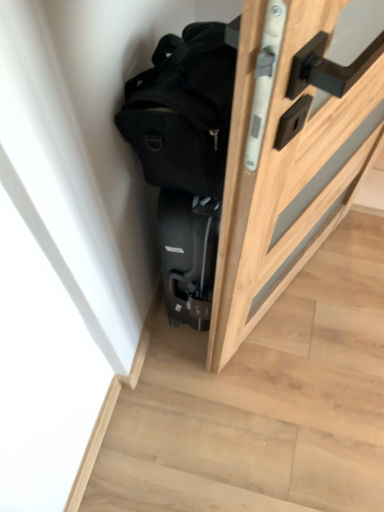
At what (x,y) coordinates should I click in order to perform the action: click on vacant space to the right of wooden door at right. Please return your answer as a coordinate pair (x, y). This screenshot has width=384, height=512. Looking at the image, I should click on (345, 291).